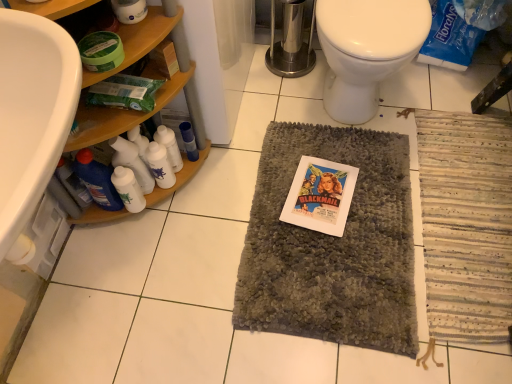
Image resolution: width=512 pixels, height=384 pixels. In order to click on vacant area in front of white glossy bottles at left, the 3th bottle in the left-to-right sequence in this screenshot , I will do `click(169, 228)`.